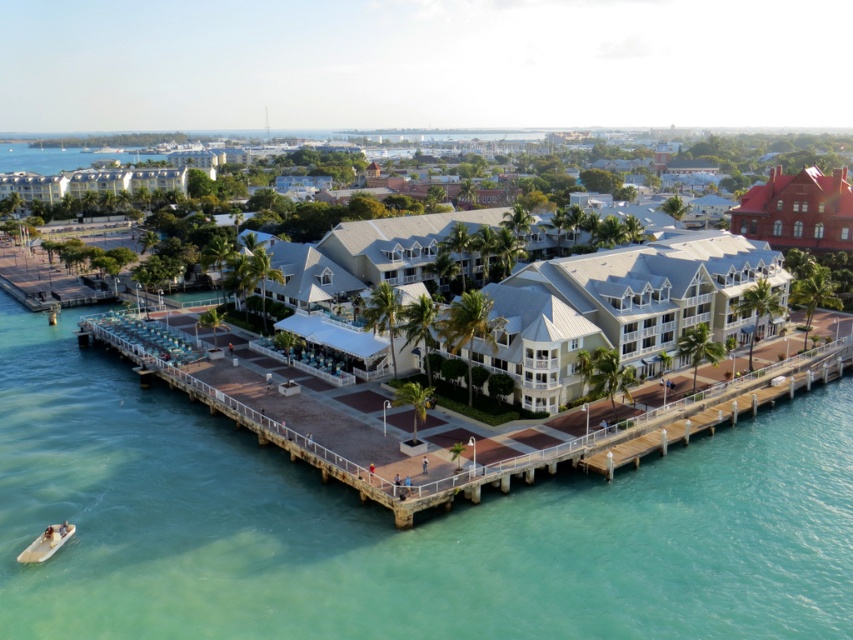
Question: From the image, what is the correct spatial relationship of white wooden dock at lower center in relation to red brick building at upper right?

Choices:
 (A) above
 (B) below

Answer: (B)

Question: Which of these objects is positioned farthest from the white wooden dock at lower center?

Choices:
 (A) red brick building at upper right
 (B) light brown wooden boat at lower left

Answer: (A)

Question: Which point is closer to the camera?

Choices:
 (A) (543, 467)
 (B) (28, 547)
 (C) (830, 230)
 (D) (572, 304)

Answer: (B)

Question: From the image, what is the correct spatial relationship of light beige stucco building at center in relation to light brown wooden boat at lower left?

Choices:
 (A) left
 (B) right

Answer: (B)

Question: Which point is closer to the camera taking this photo?

Choices:
 (A) (718, 328)
 (B) (273, 440)
 (C) (33, 556)

Answer: (C)

Question: Is red brick building at upper right smaller than light brown wooden boat at lower left?

Choices:
 (A) no
 (B) yes

Answer: (A)